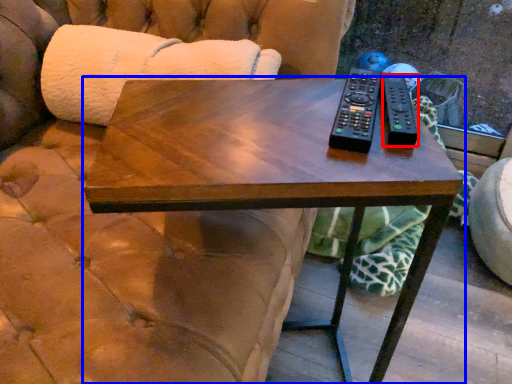
Question: Which of the following is the farthest to the observer, remote (highlighted by a red box) or coffee table (highlighted by a blue box)?

Choices:
 (A) remote
 (B) coffee table

Answer: (A)